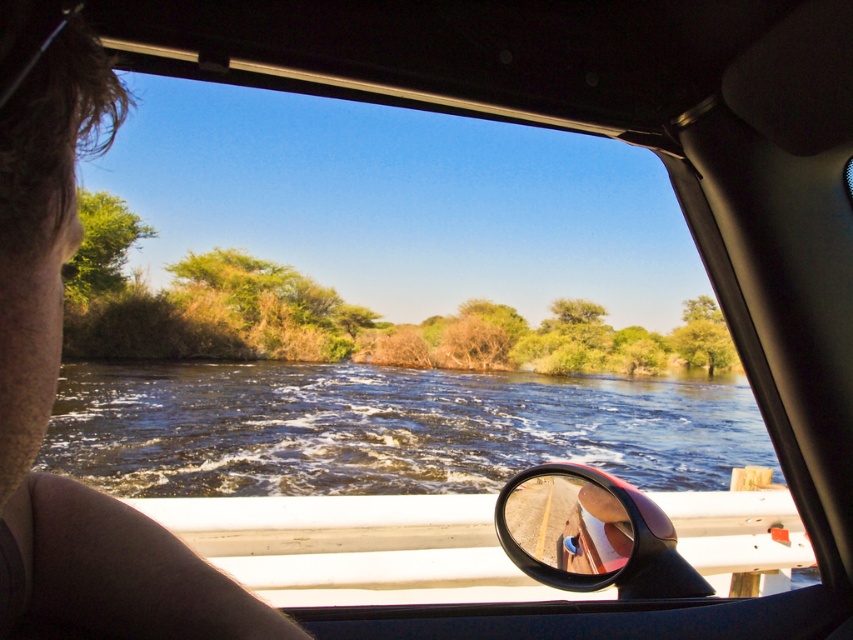
Based on the photo, does brown hair at upper left appear under glossy plastic side mirror at lower center?

No.

Who is more forward, (33, 202) or (601, 540)?

Point (33, 202) is more forward.

The image size is (853, 640). I want to click on brown hair at upper left, so (x=53, y=394).

Between brown water at center and brown hair at upper left, which one has more height?

With more height is brown water at center.

Who is more distant from viewer, (68, 420) or (229, 630)?

Point (68, 420)

Find the location of `brown water at center`. brown water at center is located at coordinates (386, 428).

Who is positioned more to the left, brown water at center or glossy plastic side mirror at lower center?

brown water at center

In the scene shown: Between brown water at center and glossy plastic side mirror at lower center, which one is positioned higher?

glossy plastic side mirror at lower center is higher up.

Between point (300, 448) and point (585, 502), which one is positioned in front?

Point (585, 502) is in front.

Locate an element on the screen. brown water at center is located at coordinates (386, 428).